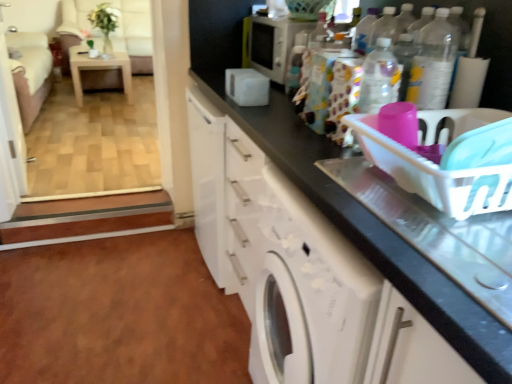
Question: From the image's perspective, is brown laminate floor at lower left on top of velvet pink couch at left?

Choices:
 (A) no
 (B) yes

Answer: (A)

Question: Would you say velvet pink couch at left is part of brown laminate floor at lower left's contents?

Choices:
 (A) yes
 (B) no

Answer: (B)

Question: From a real-world perspective, is brown laminate floor at lower left on velvet pink couch at left?

Choices:
 (A) no
 (B) yes

Answer: (A)

Question: Are brown laminate floor at lower left and velvet pink couch at left located far from each other?

Choices:
 (A) no
 (B) yes

Answer: (B)

Question: Considering the relative sizes of brown laminate floor at lower left and velvet pink couch at left in the image provided, is brown laminate floor at lower left smaller than velvet pink couch at left?

Choices:
 (A) no
 (B) yes

Answer: (B)

Question: Does brown laminate floor at lower left have a greater height compared to velvet pink couch at left?

Choices:
 (A) yes
 (B) no

Answer: (B)

Question: Would you say white glossy washing machine at center contains clear plastic bottle at upper right, which is the 1th bottle in front-to-back order?

Choices:
 (A) no
 (B) yes

Answer: (A)

Question: From a real-world perspective, is white glossy washing machine at center beneath clear plastic bottle at upper right, marked as the second bottle in a back-to-front arrangement?

Choices:
 (A) yes
 (B) no

Answer: (A)

Question: Is white glossy washing machine at center wider than clear plastic bottle at upper right, marked as the second bottle in a back-to-front arrangement?

Choices:
 (A) yes
 (B) no

Answer: (A)

Question: Does white glossy washing machine at center have a greater height compared to clear plastic bottle at upper right, placed as the first bottle when sorted from right to left?

Choices:
 (A) yes
 (B) no

Answer: (A)

Question: Does white glossy washing machine at center have a lesser width compared to clear plastic bottle at upper right, marked as the second bottle in a back-to-front arrangement?

Choices:
 (A) no
 (B) yes

Answer: (A)

Question: From the image's perspective, does white glossy washing machine at center appear lower than clear plastic bottle at upper right, which is the 1th bottle in front-to-back order?

Choices:
 (A) yes
 (B) no

Answer: (A)

Question: Does white glossy cabinet at lower center come behind patterned fabric bag at upper center, which is the 2th bottle in front-to-back order?

Choices:
 (A) no
 (B) yes

Answer: (A)